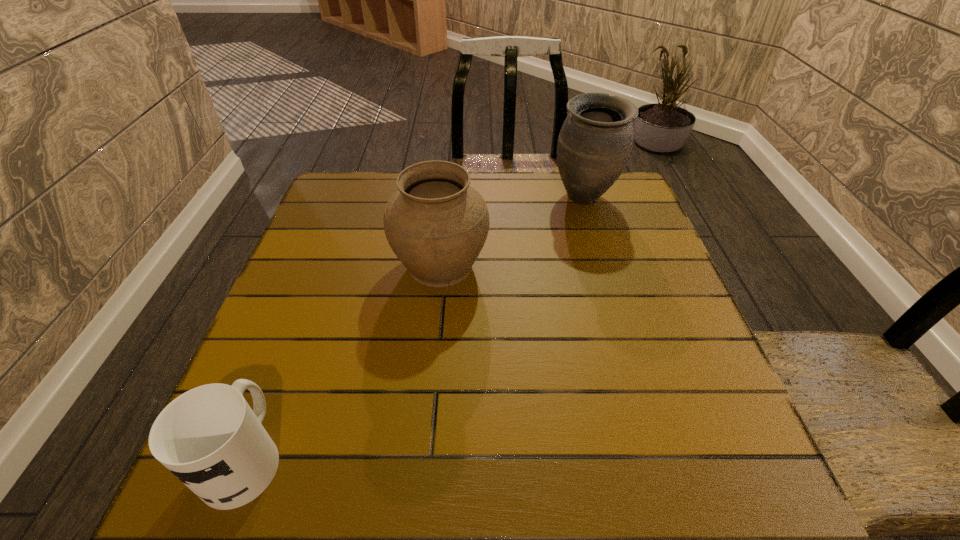
I want to click on vacant space at the right edge of the desktop, so click(x=695, y=373).

In the image, there is a desktop. Identify the location of free space at the far left corner. The width and height of the screenshot is (960, 540). [363, 187].

In the image, there is a desktop. Where is `vacant space at the near right corner`? The width and height of the screenshot is (960, 540). vacant space at the near right corner is located at coordinates (692, 457).

The width and height of the screenshot is (960, 540). Find the location of `free point between the shortest object and the nearer urn`. free point between the shortest object and the nearer urn is located at coordinates (343, 361).

The height and width of the screenshot is (540, 960). I want to click on free space between the rightmost object and the left urn, so click(513, 231).

Find the location of a particular element. The image size is (960, 540). free space between the nearest object and the nearer urn is located at coordinates (343, 361).

The height and width of the screenshot is (540, 960). Find the location of `vacant space that is in between the left urn and the rightmost object`. vacant space that is in between the left urn and the rightmost object is located at coordinates (513, 231).

Find the location of `vacant space in between the mug and the farthest object`. vacant space in between the mug and the farthest object is located at coordinates (415, 327).

Where is `vacant region between the second object from right to left and the right urn`? This screenshot has width=960, height=540. vacant region between the second object from right to left and the right urn is located at coordinates (513, 231).

Where is `free space between the second object from left to right and the nearest object`? This screenshot has height=540, width=960. free space between the second object from left to right and the nearest object is located at coordinates (343, 361).